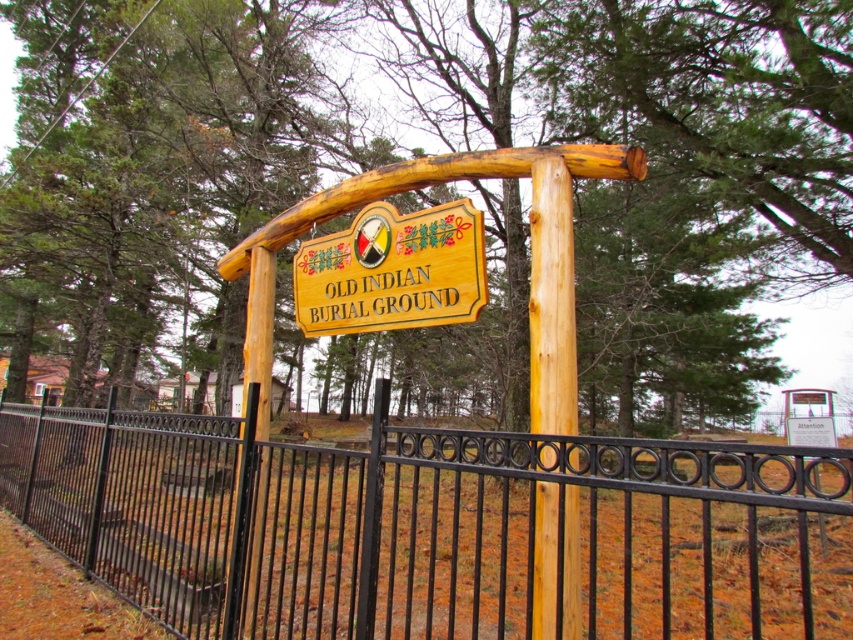
Is black wrought iron fence at center smaller than wooden sign at center?

Incorrect, black wrought iron fence at center is not smaller in size than wooden sign at center.

You are a GUI agent. You are given a task and a screenshot of the screen. Output one action in this format:
    pyautogui.click(x=<x>, y=<y>)
    Task: Click on the black wrought iron fence at center
    Image resolution: width=853 pixels, height=640 pixels.
    Given the screenshot: What is the action you would take?
    pyautogui.click(x=436, y=529)

Is point (717, 582) positioned before point (328, 264)?

That is False.

At what (x,y) coordinates should I click in order to perform the action: click on black wrought iron fence at center. Please return your answer as a coordinate pair (x, y). The image size is (853, 640). Looking at the image, I should click on (436, 529).

Who is more distant from viewer, (508, 602) or (556, 186)?

The point (508, 602) is behind.

Is black wrought iron fence at center above natural wood post at center?

Incorrect, black wrought iron fence at center is not positioned above natural wood post at center.

The height and width of the screenshot is (640, 853). Describe the element at coordinates (436, 529) in the screenshot. I see `black wrought iron fence at center` at that location.

This screenshot has width=853, height=640. I want to click on black wrought iron fence at center, so click(x=436, y=529).

Is the position of brown wood tree at center more distant than that of wooden sign at center?

That is True.

Looking at this image, who is taller, brown wood tree at center or wooden sign at center?

brown wood tree at center

This screenshot has width=853, height=640. Find the location of `brown wood tree at center`. brown wood tree at center is located at coordinates (660, 168).